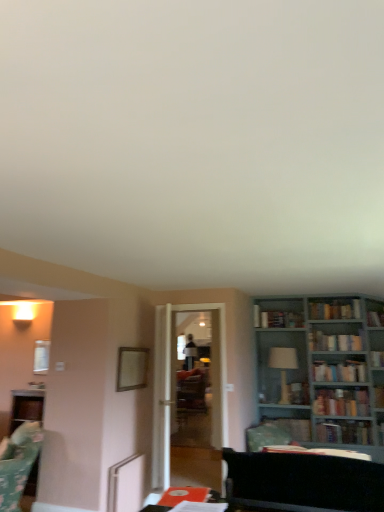
You are a GUI agent. You are given a task and a screenshot of the screen. Output one action in this format:
    pyautogui.click(x=<x>, y=<y>)
    Task: Click on the empty space that is ontop of black fabric futon at lower right (from a real-world perspective)
    Image resolution: width=384 pixels, height=512 pixels.
    Given the screenshot: What is the action you would take?
    pyautogui.click(x=311, y=448)